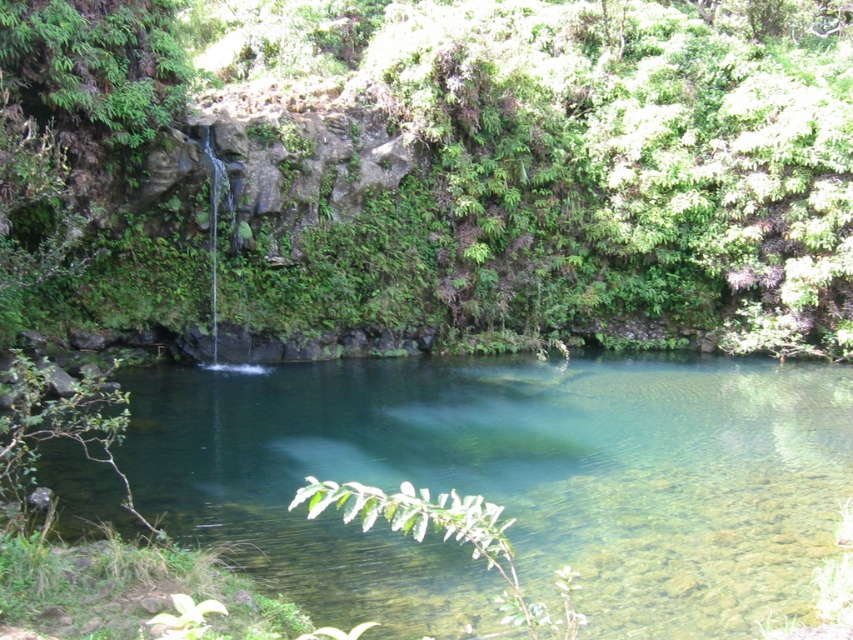
Looking at this image, you are a hiker trying to cross the clear glass lake at center using a narrow wooden plank. The green leafy vegetation at upper center is blocking your path. Can you move the plank to the right to bypass the vegetation and still reach the lake?

The green leafy vegetation at upper center might be wider than clear glass lake at center, so moving the plank to the right may not be possible as the vegetation could extend beyond the lake width, blocking access.

You are standing in the scene and want to locate the green leafy vegetation at upper center. According to the coordinates provided, where exactly would you look?

The green leafy vegetation at upper center is located at the 2D coordinates point (440, 168).

You are standing at the edge of the clear glass lake at center and want to look up at the green leafy vegetation at upper center. In which direction should you turn your head?

You should turn your head to the right because the green leafy vegetation at upper center is located to the right of the clear glass lake at center.